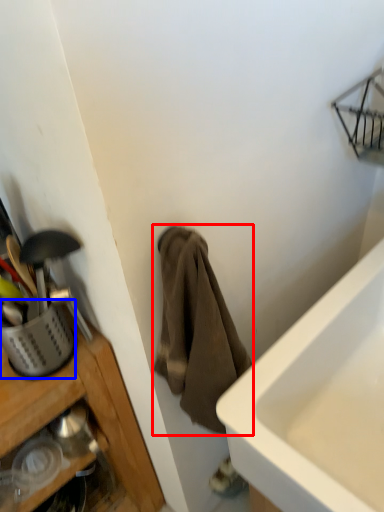
Question: Which object appears closest to the camera in this image, towel/napkin (highlighted by a red box) or basket (highlighted by a blue box)?

Choices:
 (A) towel/napkin
 (B) basket

Answer: (A)